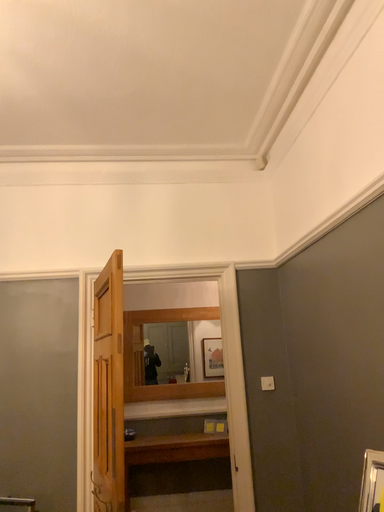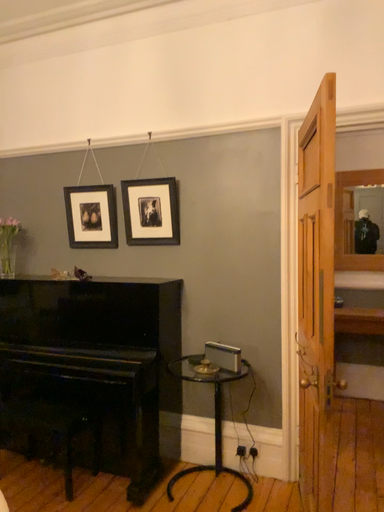
Question: Which way did the camera rotate in the video?

Choices:
 (A) rotated left
 (B) rotated right

Answer: (A)